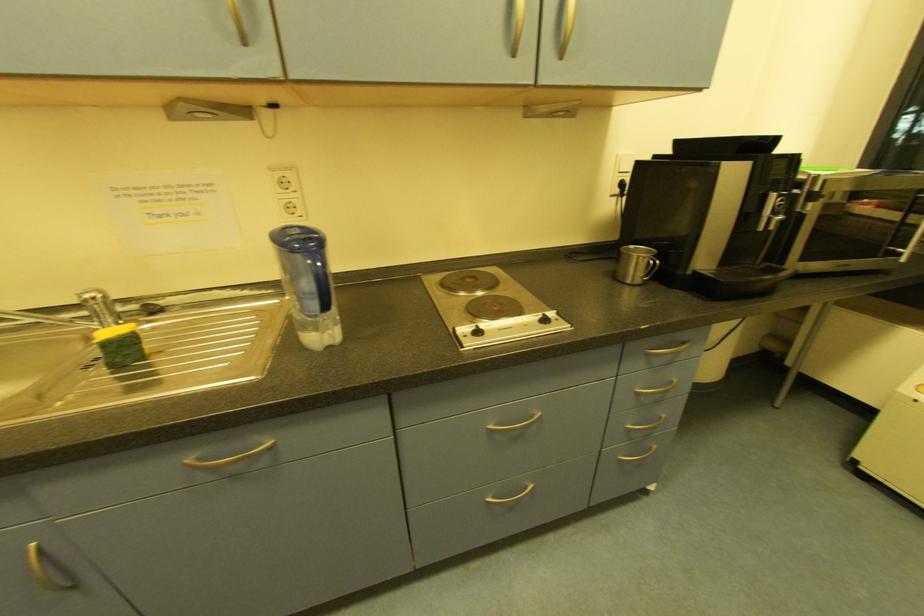
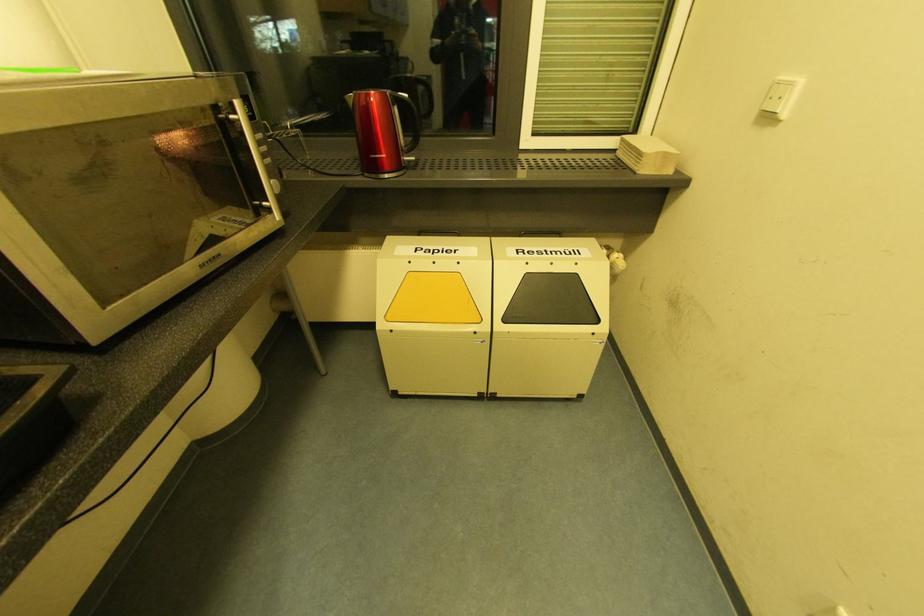
How did the camera likely rotate?

The camera's rotation is toward right-down.